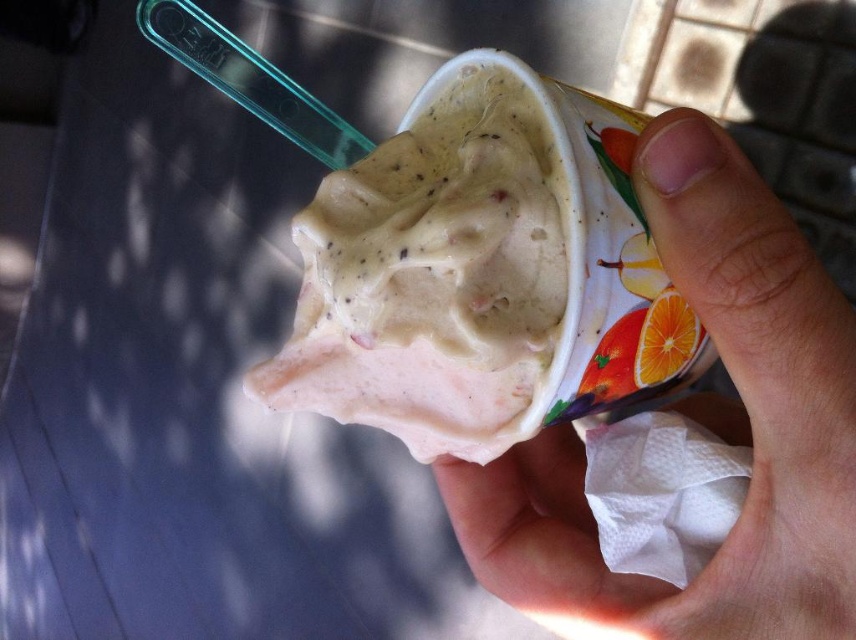
Question: Does smooth skin hand at center have a smaller size compared to orange matte at upper right?

Choices:
 (A) yes
 (B) no

Answer: (B)

Question: Does smooth skin hand at center lie behind orange matte at upper right?

Choices:
 (A) no
 (B) yes

Answer: (A)

Question: Which point appears farthest from the camera in this image?

Choices:
 (A) (681, 317)
 (B) (461, 468)
 (C) (501, 120)

Answer: (B)

Question: Which point appears farthest from the camera in this image?

Choices:
 (A) (530, 248)
 (B) (684, 336)
 (C) (777, 628)

Answer: (B)

Question: Among these points, which one is nearest to the camera?

Choices:
 (A) (387, 419)
 (B) (666, 378)
 (C) (846, 588)

Answer: (C)

Question: Can you confirm if whipped cream at center is bigger than orange matte at upper right?

Choices:
 (A) yes
 (B) no

Answer: (A)